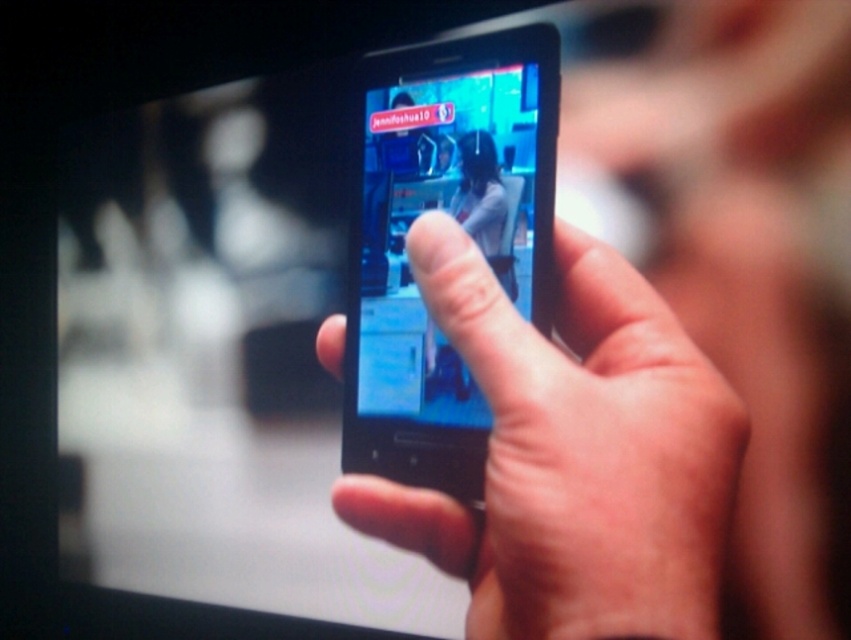
Is point (687, 556) farther from camera compared to point (409, 204)?

That is False.

Based on the photo, does matte black phone at center have a lesser width compared to shiny blue phone at center?

No.

Locate an element on the screen. matte black phone at center is located at coordinates (572, 454).